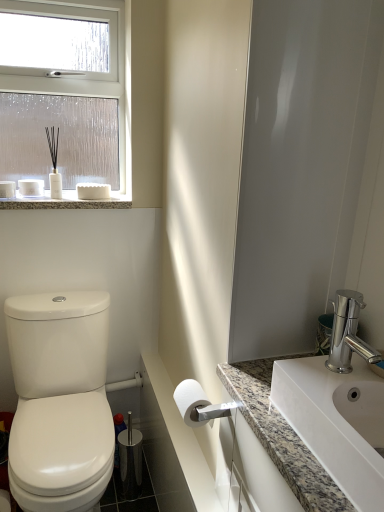
Question: From a real-world perspective, is granite countertop at lower right, the 1th counter top from the right, physically located above or below polished chrome faucet at right?

Choices:
 (A) above
 (B) below

Answer: (B)

Question: From their relative heights in the image, would you say granite countertop at lower right, the second counter top positioned from the left, is taller or shorter than polished chrome faucet at right?

Choices:
 (A) short
 (B) tall

Answer: (B)

Question: Considering the real-world distances, which object is farthest from the granite countertop at upper left?

Choices:
 (A) white glossy toilet at left
 (B) white matte toilet paper at center
 (C) white marble countertop at lower center, the 2th counter top in the right-to-left sequence
 (D) polished chrome faucet at right
 (E) white glossy sink at right

Answer: (E)

Question: Which is nearer to the granite countertop at upper left?

Choices:
 (A) white plastic towel bar at lower center
 (B) granite countertop at lower right, the 1th counter top from the right
 (C) clear glass window at upper left
 (D) polished chrome faucet at right
 (E) white glossy sink at right

Answer: (C)